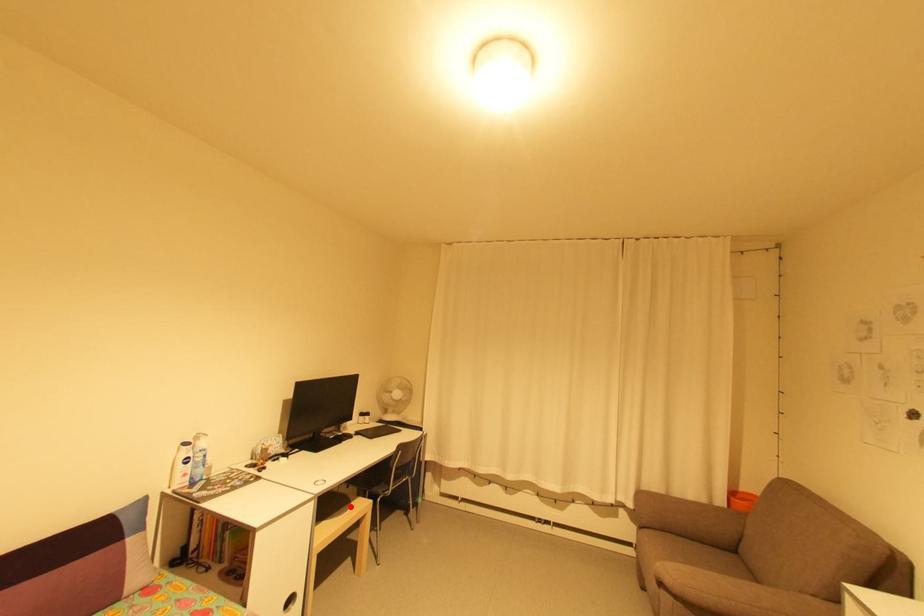
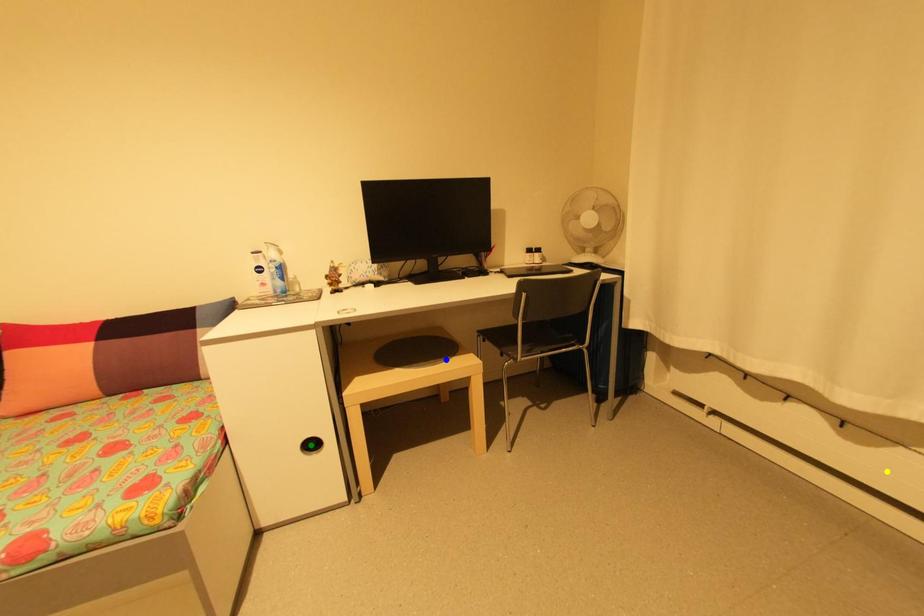
Question: I am providing you with two images of the same scene from different viewpoints. A red point is marked on the first image. You are given multiple points on the second image. Which spot in image 2 lines up with the point in image 1?

Choices:
 (A) blue point
 (B) green point
 (C) yellow point

Answer: (A)